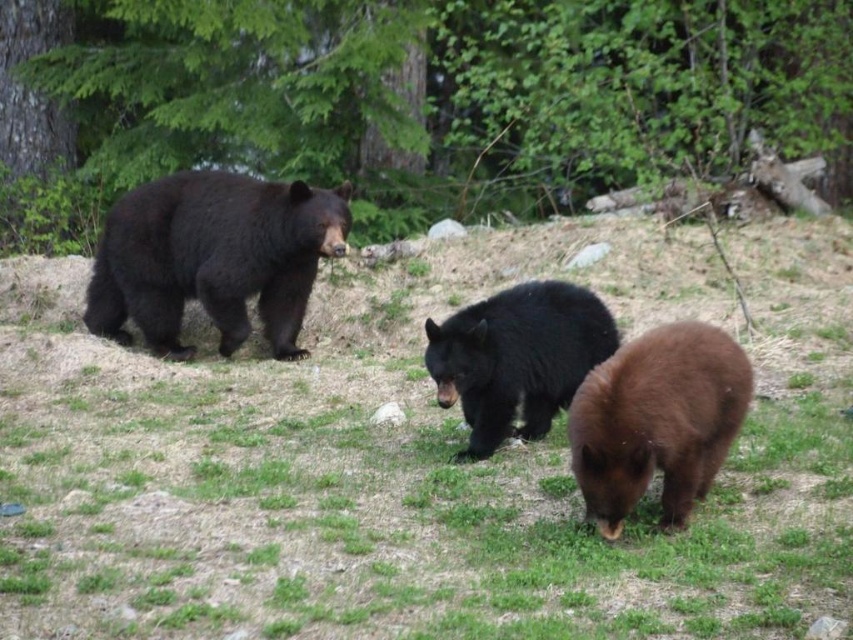
You are a photographer standing at the position of the camera, aiming to take a photo of both the green leafy tree at upper center and the brown furry bear at center. Can you fit both subjects into your camera frame if your camera has a maximum field of view of 5 meters between the nearest and farthest objects?

The distance between the green leafy tree at upper center and the brown furry bear at center is 4.20 meters, which is within the camera frame of 5 meters. Therefore, both subjects can be captured in the photo.

You are a photographer trying to capture a photo of the brown furry bear at center without the green leafy tree at upper center blocking the view. Which direction should you move to ensure the tree is out of frame?

To avoid the green leafy tree at upper center blocking the view of the brown furry bear at center, you should move to the right. Since the tree is on the left side of the bear, moving right would shift the perspective so the tree moves out of frame while keeping the bear in view.